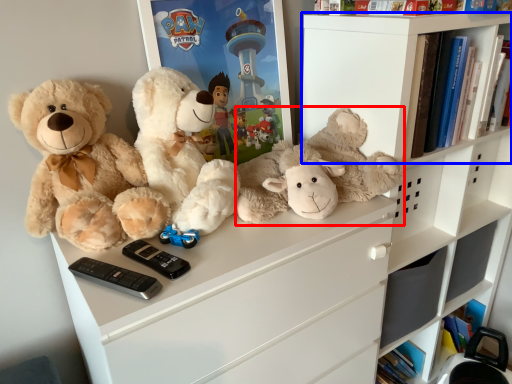
Question: Which object appears farthest to the camera in this image, teddy bear (highlighted by a red box) or shelf (highlighted by a blue box)?

Choices:
 (A) teddy bear
 (B) shelf

Answer: (B)